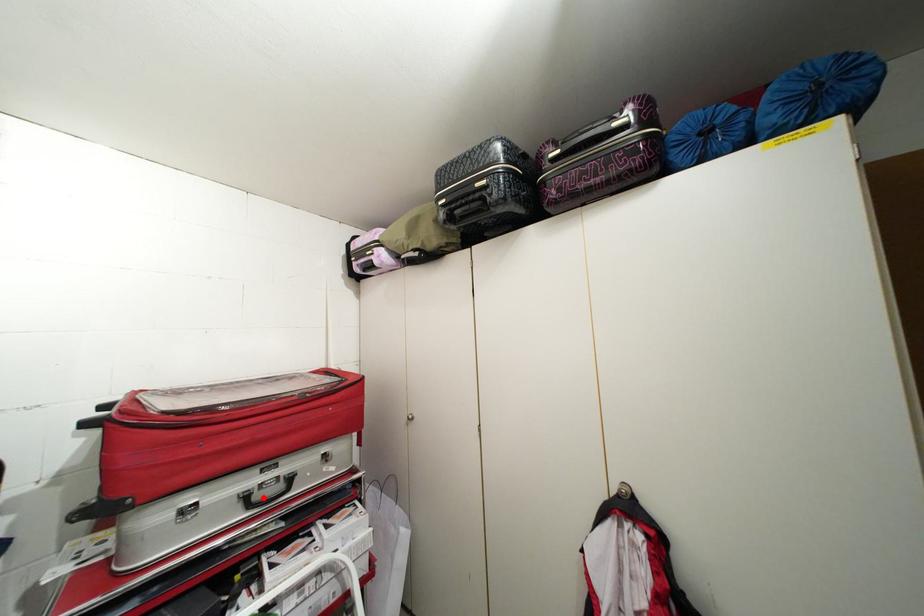
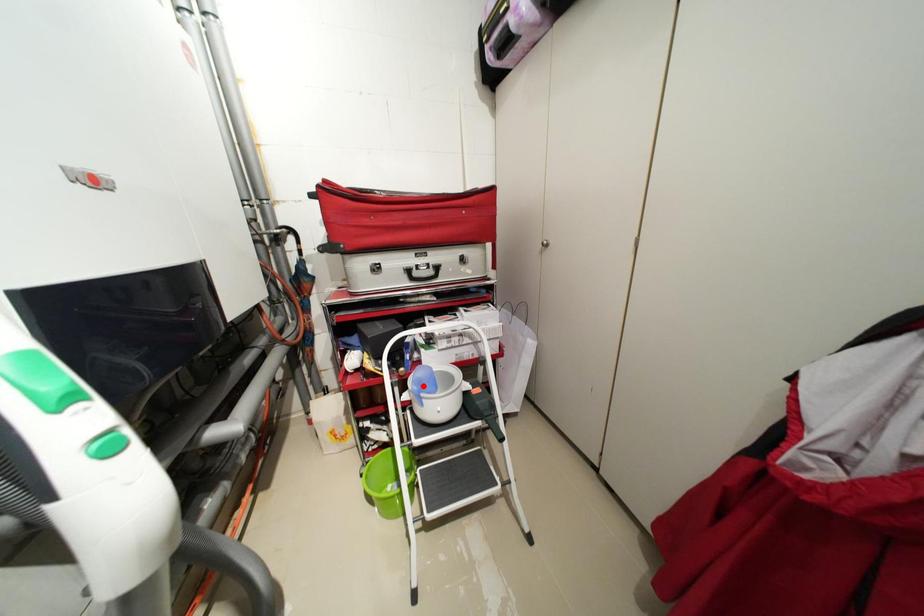
I am providing you with two images of the same scene from different viewpoints. A red point is marked on the first image and another point is marked on the second image. Are the points marked in image1 and image2 representing the same 3D position?

No